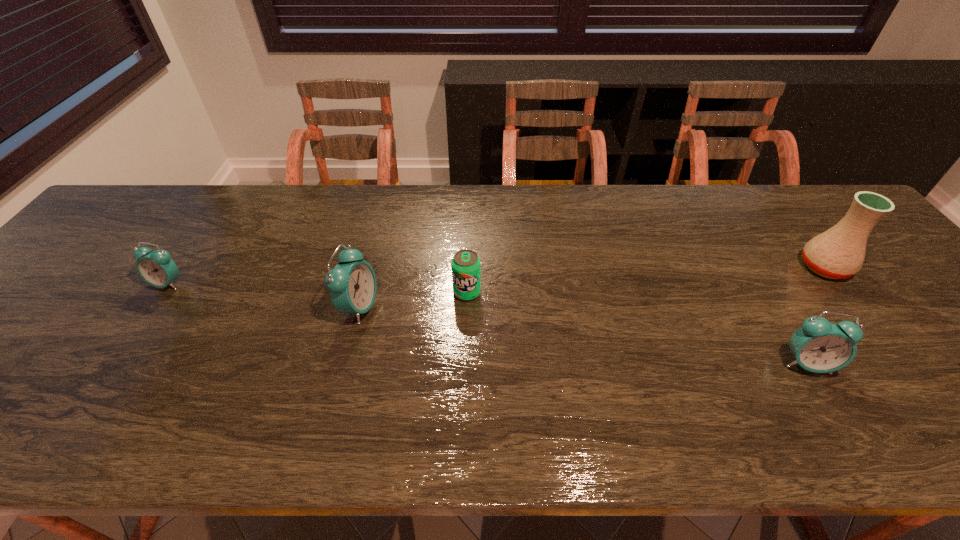
Where is `empty space between the second shortest alarm clock and the leftmost object`? This screenshot has width=960, height=540. empty space between the second shortest alarm clock and the leftmost object is located at coordinates (487, 323).

Locate an element on the screen. The image size is (960, 540). free space that is in between the rightmost object and the pop soda is located at coordinates (646, 280).

Where is `vacant region between the pop soda and the leftmost object`? The width and height of the screenshot is (960, 540). vacant region between the pop soda and the leftmost object is located at coordinates [x=318, y=288].

Find the location of a particular element. The width and height of the screenshot is (960, 540). vacant area that lies between the nearest alarm clock and the shortest alarm clock is located at coordinates (487, 323).

You are a GUI agent. You are given a task and a screenshot of the screen. Output one action in this format:
    pyautogui.click(x=<x>, y=<y>)
    Task: Click on the fourth closest object to the nearest object
    
    Given the screenshot: What is the action you would take?
    pyautogui.click(x=156, y=268)

Locate an element on the screen. object that is the second closest to the second object from left to right is located at coordinates (156, 268).

The image size is (960, 540). In order to click on alarm clock object that ranks as the second closest to the pop soda in this screenshot , I will do `click(819, 346)`.

Identify which alarm clock is located as the nearest to the second shortest alarm clock. Please provide its 2D coordinates. Your answer should be formatted as a tuple, i.e. [(x, y)], where the tuple contains the x and y coordinates of a point satisfying the conditions above.

[(352, 283)]